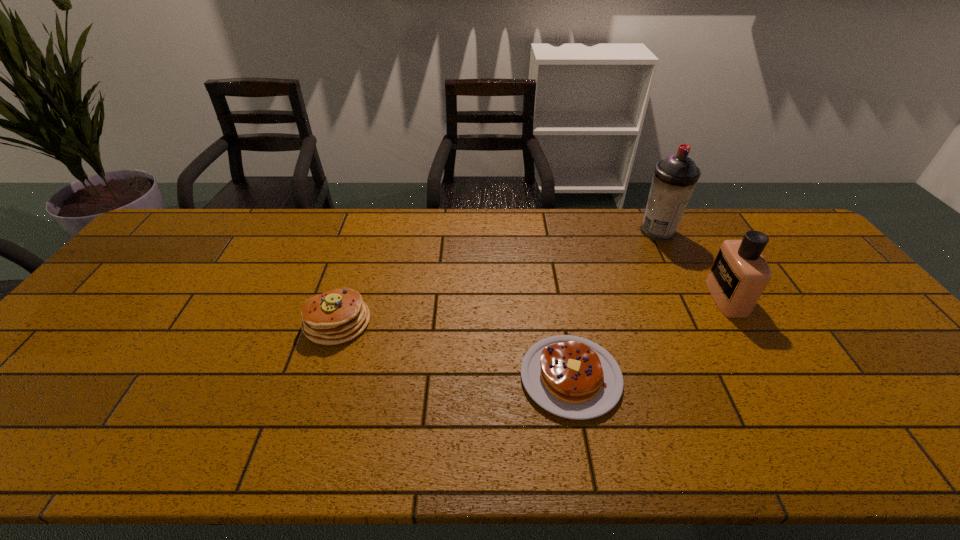
What are the coordinates of `vacant space that satisfies the following two spatial constraints: 1. on the front label of the second tallest object; 2. on the front side of the second shortest object` in the screenshot? It's located at (740, 322).

Locate an element on the screen. free location that satisfies the following two spatial constraints: 1. on the back side of the shorter pancake; 2. on the right side of the aerosol can is located at coordinates (544, 232).